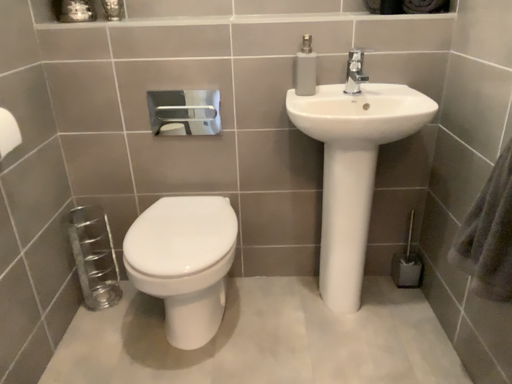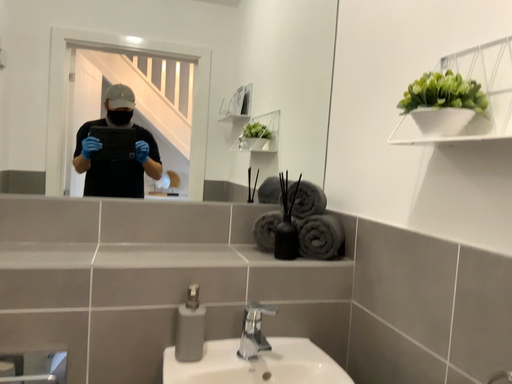
Question: Which way did the camera rotate in the video?

Choices:
 (A) rotated left
 (B) rotated right

Answer: (B)